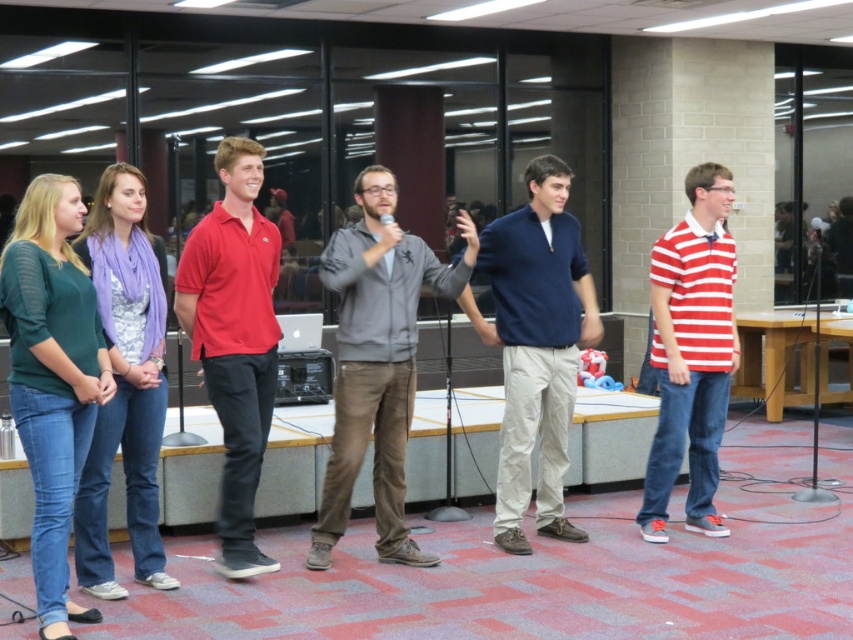
Measure the distance between point [351,381] and camera.

The distance of point [351,381] from camera is 17.96 feet.

Who is higher up, gray zip-up jacket at center or matte red polo shirt at center?

Positioned higher is matte red polo shirt at center.

Locate an element on the screen. gray zip-up jacket at center is located at coordinates (x=376, y=362).

Who is positioned more to the right, gray zip-up jacket at center or blue cotton shirt at center?

blue cotton shirt at center

Between gray zip-up jacket at center and blue cotton shirt at center, which one is positioned higher?

blue cotton shirt at center

Does point (357, 388) come farther from viewer compared to point (567, 172)?

No, it is in front of (567, 172).

Where is `gray zip-up jacket at center`? Image resolution: width=853 pixels, height=640 pixels. gray zip-up jacket at center is located at coordinates (376, 362).

Between gray zip-up jacket at center and black plastic microphone at center, which one appears on the left side from the viewer's perspective?

From the viewer's perspective, black plastic microphone at center appears more on the left side.

Where is `gray zip-up jacket at center`? The height and width of the screenshot is (640, 853). gray zip-up jacket at center is located at coordinates (376, 362).